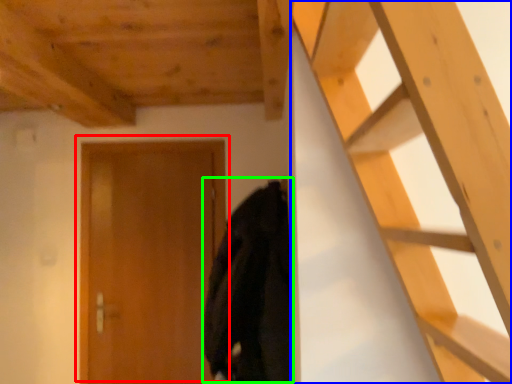
Question: Based on their relative distances, which object is farther from door (highlighted by a red box)? Choose from ladder (highlighted by a blue box) and cloak (highlighted by a green box).

Choices:
 (A) ladder
 (B) cloak

Answer: (A)